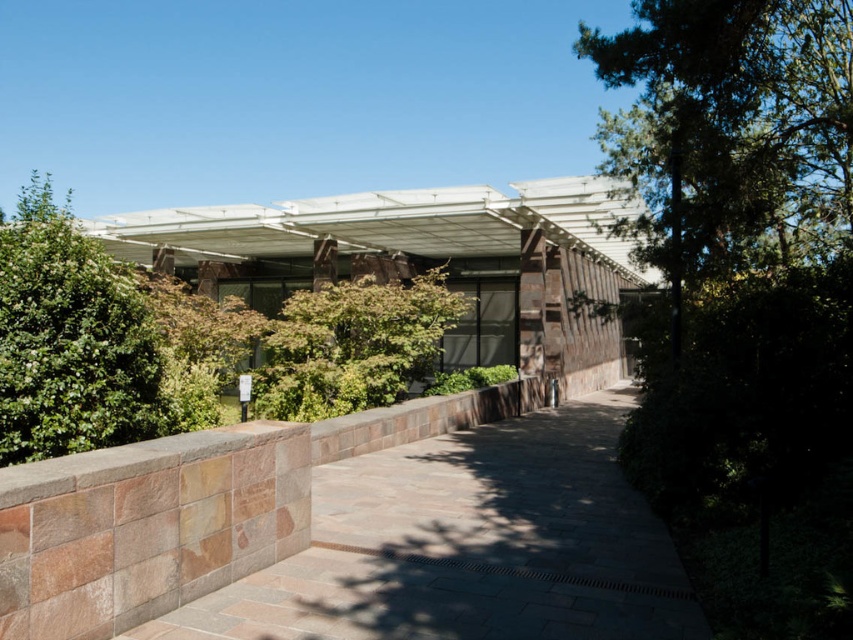
Question: Does green leafy bush at left have a lesser width compared to green leafy tree at center?

Choices:
 (A) yes
 (B) no

Answer: (B)

Question: Considering the relative positions of green leafy bush at left and green leafy tree at center in the image provided, where is green leafy bush at left located with respect to green leafy tree at center?

Choices:
 (A) below
 (B) above

Answer: (B)

Question: Does brown stone path at center lie in front of green leafy bush at left?

Choices:
 (A) yes
 (B) no

Answer: (A)

Question: Estimate the real-world distances between objects in this image. Which object is closer to the brown stone path at center?

Choices:
 (A) green leafy tree at center
 (B) green leafy bush at left

Answer: (A)

Question: Which of the following is the closest to the observer?

Choices:
 (A) green leafy bush at left
 (B) brown stone path at center
 (C) green leafy tree at center

Answer: (B)

Question: Which point is closer to the camera?

Choices:
 (A) brown stone path at center
 (B) green leafy bush at left

Answer: (A)